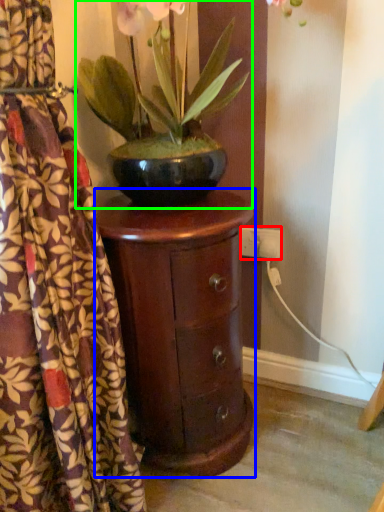
Question: Considering the real-world distances, which object is closest to electric outlet (highlighted by a red box)? nightstand (highlighted by a blue box) or houseplant (highlighted by a green box).

Choices:
 (A) nightstand
 (B) houseplant

Answer: (A)